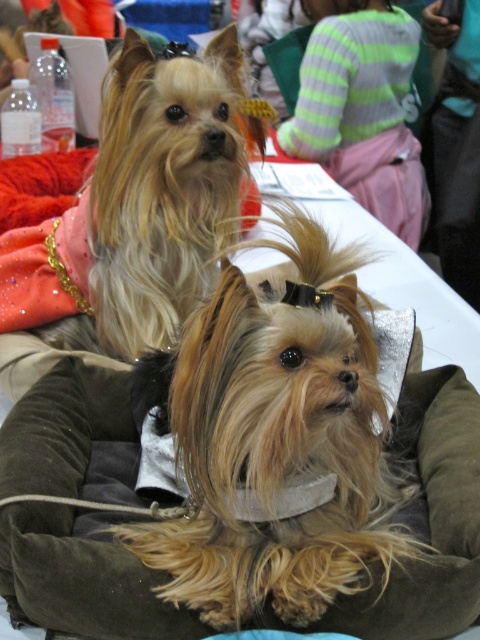
Please provide the coordinates of the shiny blonde fur at center in the image using the coordinate system where the top left corner is the origin point. The coordinate system is normalized between 0 and 1 for both x and y axes. The answer should be in the format of a tuple with two decimal numbers rounded to three decimal places. The question must not mention the coordinate system details or the origin point.

The coordinates of the shiny blonde fur at center are at point (134, 216).